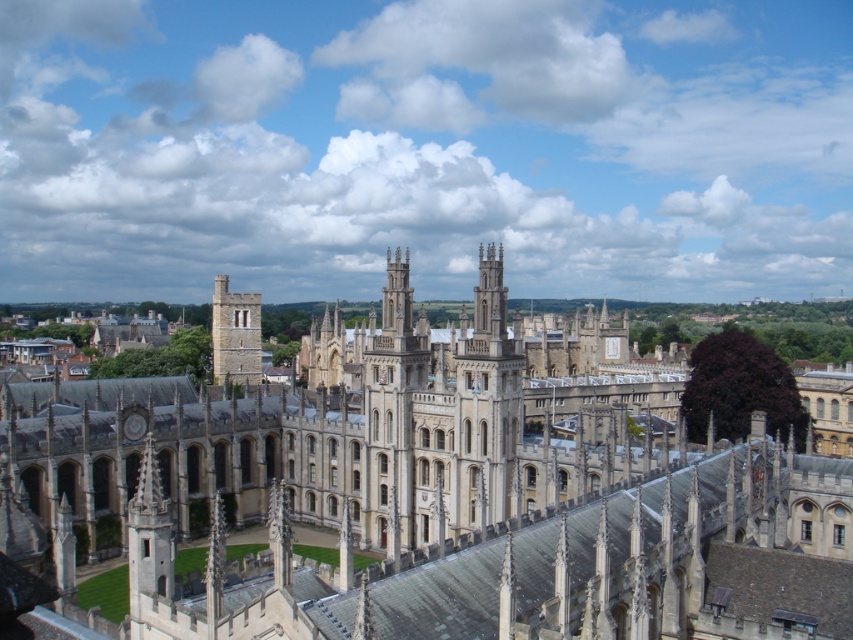
Question: Is the position of beige stone cathedral at center more distant than that of stone tower at center-left?

Choices:
 (A) no
 (B) yes

Answer: (A)

Question: Does beige stone cathedral at center appear on the right side of stone tower at center-left?

Choices:
 (A) yes
 (B) no

Answer: (A)

Question: Among these points, which one is nearest to the camera?

Choices:
 (A) (248, 316)
 (B) (160, 428)

Answer: (B)

Question: Among these points, which one is nearest to the camera?

Choices:
 (A) (225, 300)
 (B) (109, 496)

Answer: (B)

Question: Is beige stone cathedral at center closer to camera compared to stone tower at center-left?

Choices:
 (A) no
 (B) yes

Answer: (B)